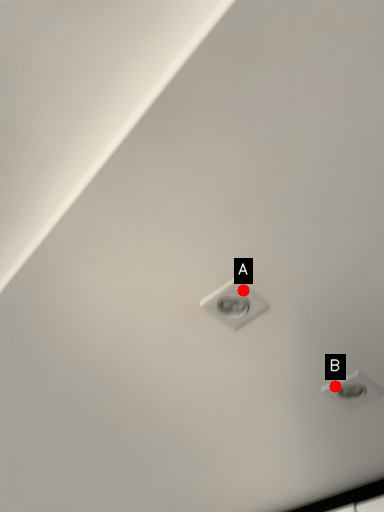
Question: Two points are circled on the image, labeled by A and B beside each circle. Which point is further to the camera?

Choices:
 (A) A is further
 (B) B is further

Answer: (B)